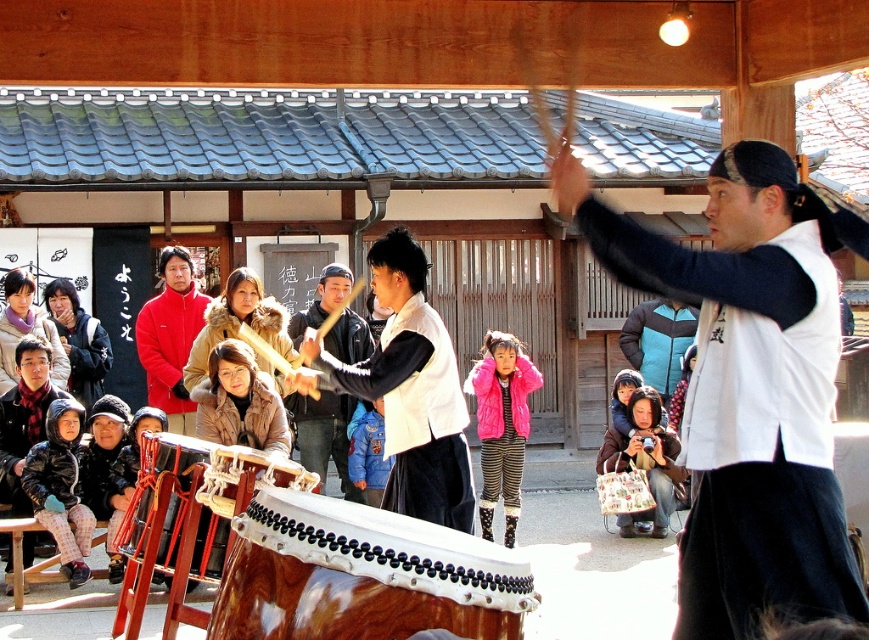
Question: Which object is closer to the camera taking this photo?

Choices:
 (A) fluffy pink coat at lower center
 (B) matte black vest at center
 (C) white matte vest at center

Answer: (C)

Question: Which point appears closest to the camera in this image?

Choices:
 (A) coord(387,298)
 (B) coord(216,563)

Answer: (B)

Question: Which object is farther from the camera taking this photo?

Choices:
 (A) fluffy pink coat at lower center
 (B) wooden drum at lower left
 (C) blue denim jacket at center

Answer: (A)

Question: In this image, where is wooden drum at lower left located relative to black matte kimono at center?

Choices:
 (A) left
 (B) right

Answer: (A)

Question: Observing the image, what is the correct spatial positioning of shiny brown drum at center in reference to wooden drum at center?

Choices:
 (A) above
 (B) below

Answer: (B)

Question: Can you confirm if wooden drum at lower left is positioned below wooden drum at center?

Choices:
 (A) no
 (B) yes

Answer: (B)